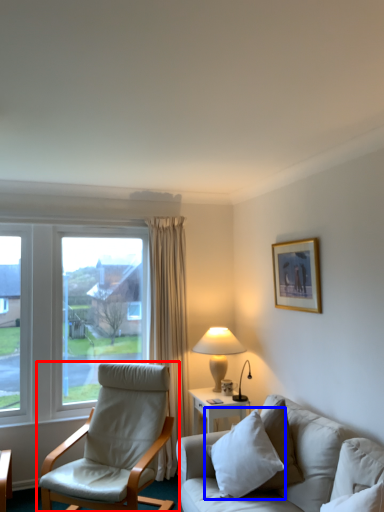
Question: Which object is further to the camera taking this photo, chair (highlighted by a red box) or pillow (highlighted by a blue box)?

Choices:
 (A) chair
 (B) pillow

Answer: (A)